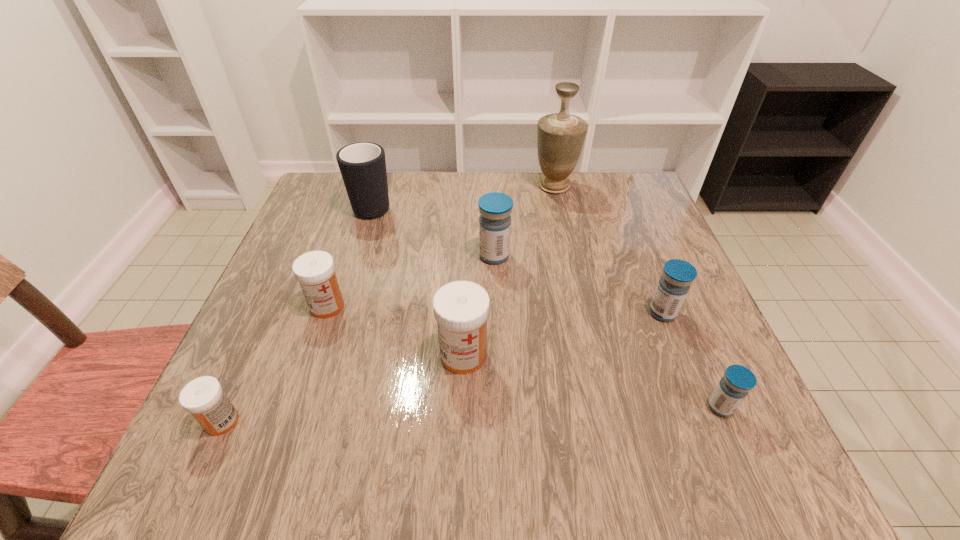
Identify the location of free spot at the right edge of the desktop. This screenshot has width=960, height=540. (699, 353).

At what (x,y) coordinates should I click in order to perform the action: click on free space at the far left corner. Please return your answer as a coordinate pair (x, y). Looking at the image, I should click on (344, 212).

The height and width of the screenshot is (540, 960). Find the location of `free space at the far right corner of the desktop`. free space at the far right corner of the desktop is located at coordinates (607, 173).

Identify the location of vacant point located between the second biggest blue medicine and the farthest white medicine. The height and width of the screenshot is (540, 960). (495, 309).

At what (x,y) coordinates should I click in order to perform the action: click on unoccupied area between the smallest blue medicine and the second farthest white medicine. Please return your answer as a coordinate pair (x, y). This screenshot has width=960, height=540. Looking at the image, I should click on (591, 381).

Find the location of a particular element. unoccupied area between the smallest white medicine and the urn is located at coordinates (388, 303).

The image size is (960, 540). I want to click on empty space that is in between the smallest white medicine and the second nearest white medicine, so click(x=343, y=388).

I want to click on free spot between the smallest blue medicine and the fifth medicine from right to left, so click(524, 356).

Identify the location of free area in between the second white medicine from left to right and the urn. The width and height of the screenshot is (960, 540). (441, 246).

Where is `vacant space in between the nearest blue medicine and the third object from right to left`? vacant space in between the nearest blue medicine and the third object from right to left is located at coordinates (637, 296).